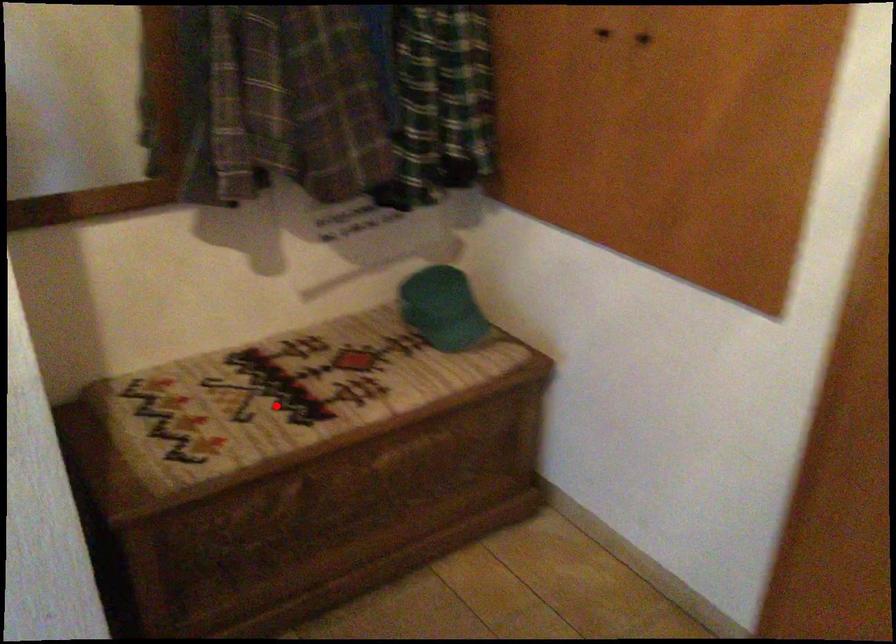
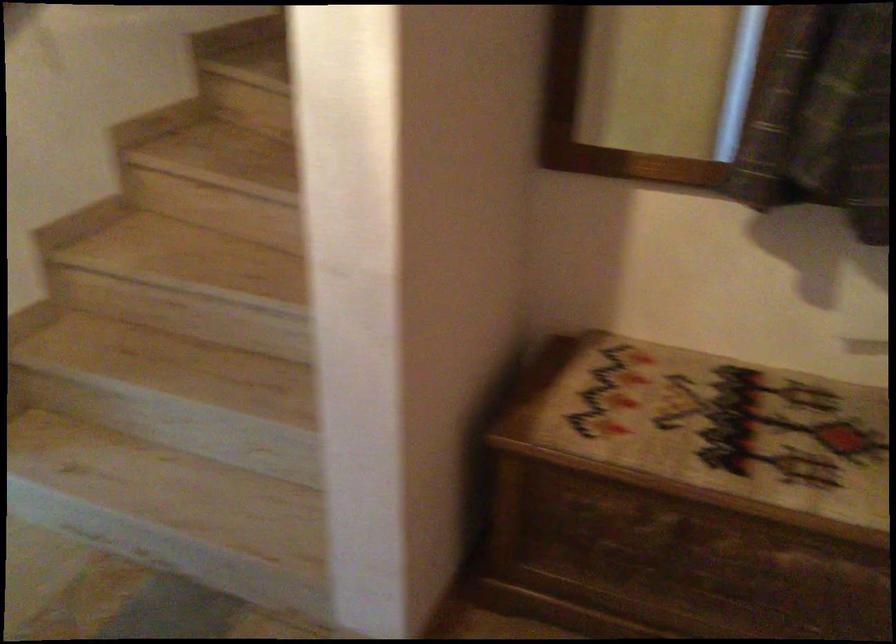
Where in the second image is the point corresponding to the highlighted location from the first image?

(709, 431)